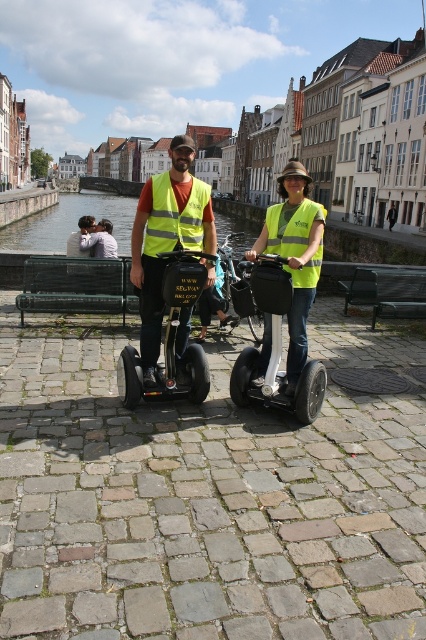
Question: Which is farther from the yellow reflective vest at center?

Choices:
 (A) high-visibility yellow safety vest at center
 (B) black metal park bench at center

Answer: (B)

Question: Is high-visibility yellow safety vest at center thinner than light brown leather bench at center?

Choices:
 (A) no
 (B) yes

Answer: (A)

Question: Is the position of metallic silver scooter at center more distant than that of green metal bench at left?

Choices:
 (A) no
 (B) yes

Answer: (A)

Question: Among these objects, which one is nearest to the camera?

Choices:
 (A) reflective yellow safety vest at center
 (B) metallic silver scooter at center
 (C) yellow reflective vest at center

Answer: (B)

Question: From the image, what is the correct spatial relationship of black rubber segway at center in relation to metallic silver scooter at center?

Choices:
 (A) left
 (B) right

Answer: (A)

Question: Which object is positioned closest to the black metal park bench at center?

Choices:
 (A) light brown leather bench at center
 (B) metallic silver scooter at center
 (C) reflective yellow safety vest at center

Answer: (B)